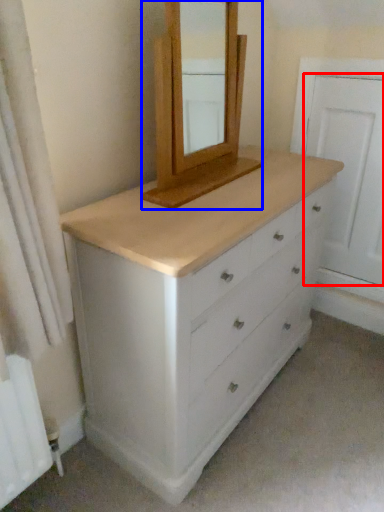
Question: Which of the following is the farthest to the observer, screen door (highlighted by a red box) or medicine cabinet (highlighted by a blue box)?

Choices:
 (A) screen door
 (B) medicine cabinet

Answer: (A)